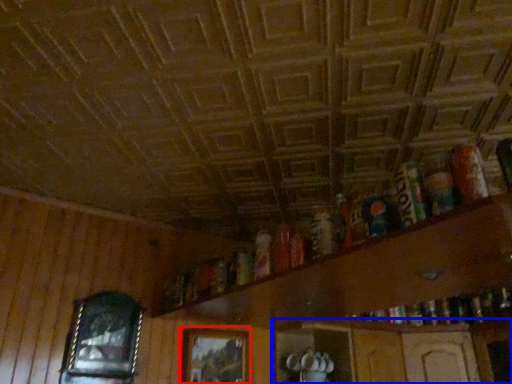
Question: Which object appears farthest to the camera in this image, picture frame (highlighted by a red box) or shelf (highlighted by a blue box)?

Choices:
 (A) picture frame
 (B) shelf

Answer: (B)